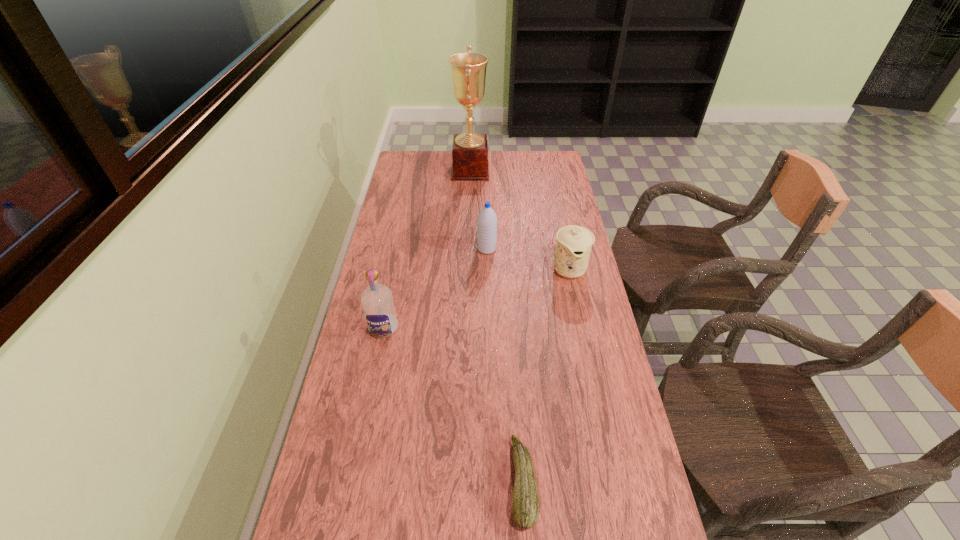
The image size is (960, 540). What are the coordinates of `trophy cup` in the screenshot? It's located at (470, 150).

I want to click on the tallest object, so click(x=470, y=150).

Identify the location of the fourth farthest object. (377, 301).

The width and height of the screenshot is (960, 540). I want to click on vodka, so click(x=377, y=301).

Locate an element on the screen. This screenshot has width=960, height=540. water bottle is located at coordinates (487, 220).

Where is `chinaware`? chinaware is located at coordinates (574, 243).

In order to click on the shortest object in this screenshot , I will do `click(525, 501)`.

Locate an element on the screen. The width and height of the screenshot is (960, 540). the nearest object is located at coordinates (525, 501).

This screenshot has width=960, height=540. I want to click on free location located 0.130m on the plaque of the trophy cup, so click(517, 171).

Where is `free space located on the label of the leftmost object`? The height and width of the screenshot is (540, 960). free space located on the label of the leftmost object is located at coordinates (372, 380).